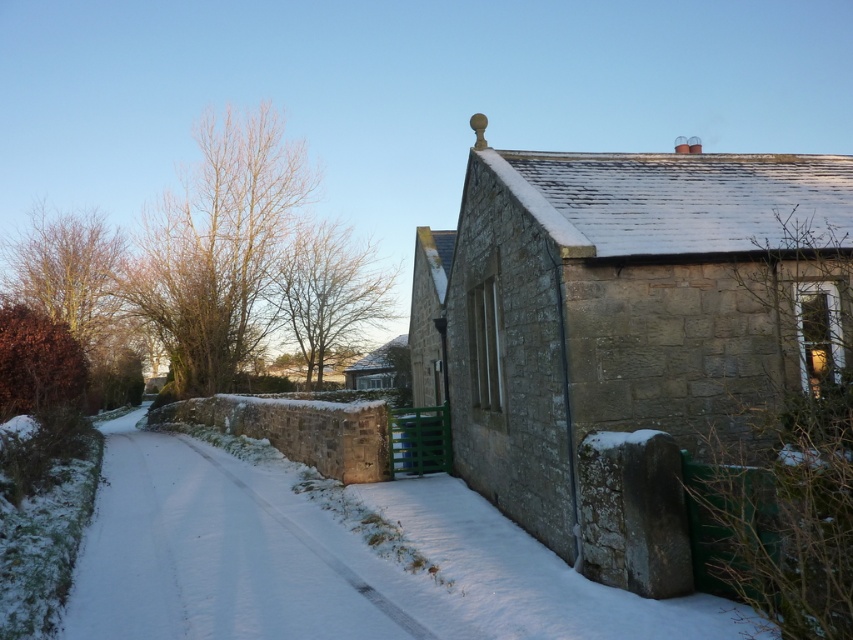
Question: Which of the following is the farthest from the observer?

Choices:
 (A) (229, 456)
 (B) (804, 300)

Answer: (A)

Question: Can you confirm if stone house at right is wider than white snow-covered path at center?

Choices:
 (A) yes
 (B) no

Answer: (B)

Question: Is stone house at right smaller than matte stone hut at center?

Choices:
 (A) no
 (B) yes

Answer: (A)

Question: Does white snow-covered path at center appear over matte stone hut at center?

Choices:
 (A) yes
 (B) no

Answer: (B)

Question: Which of these objects is positioned closest to the white snow-covered path at center?

Choices:
 (A) matte stone hut at center
 (B) stone house at right

Answer: (B)

Question: Estimate the real-world distances between objects in this image. Which object is farther from the stone house at right?

Choices:
 (A) matte stone hut at center
 (B) white snow-covered path at center

Answer: (A)